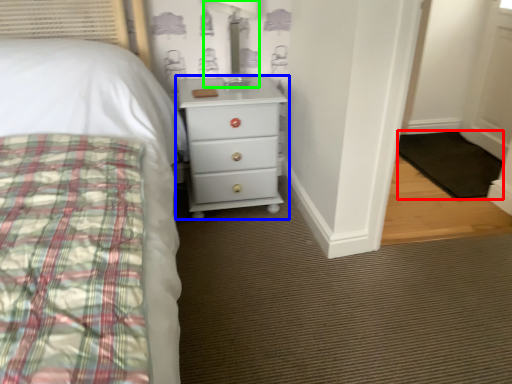
Question: Estimate the real-world distances between objects in this image. Which object is farther from mat (highlighted by a red box), chest of drawers (highlighted by a blue box) or table lamp (highlighted by a green box)?

Choices:
 (A) chest of drawers
 (B) table lamp

Answer: (B)